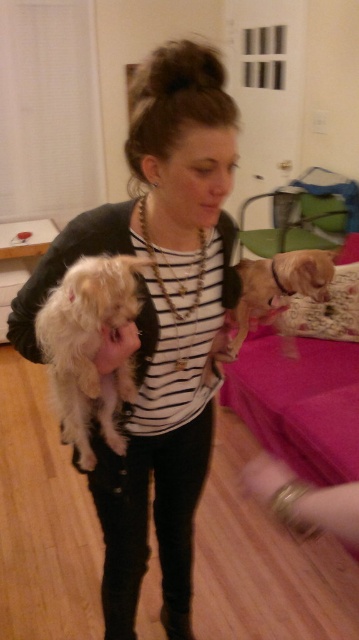
Which is more to the right, fluffy white dog at center or light brown fur at center?

Positioned to the right is light brown fur at center.

Which is behind, point (73, 410) or point (278, 298)?

Positioned behind is point (278, 298).

Identify the location of fluffy white dog at center. (89, 348).

Is white striped shirt at center wider than light brown fur at center?

Yes.

From the picture: Which of these two, white striped shirt at center or light brown fur at center, stands shorter?

Standing shorter between the two is light brown fur at center.

Describe the element at coordinates (157, 323) in the screenshot. This screenshot has width=359, height=640. I see `white striped shirt at center` at that location.

The height and width of the screenshot is (640, 359). I want to click on white striped shirt at center, so click(157, 323).

Looking at this image, who is shorter, gold metallic bracelet at lower right or light brown fur at center?

gold metallic bracelet at lower right

Does point (310, 515) lie in front of point (230, 353)?

Yes, point (310, 515) is closer to viewer.

In order to click on gold metallic bracelet at lower right in this screenshot , I will do `click(304, 500)`.